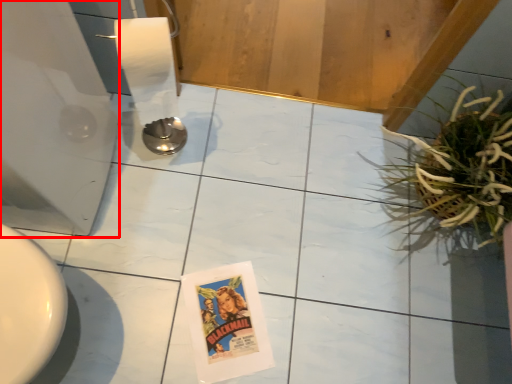
Question: Considering the relative positions of appliance (annotated by the red box) and houseplant in the image provided, where is appliance (annotated by the red box) located with respect to the staircase?

Choices:
 (A) right
 (B) left

Answer: (B)